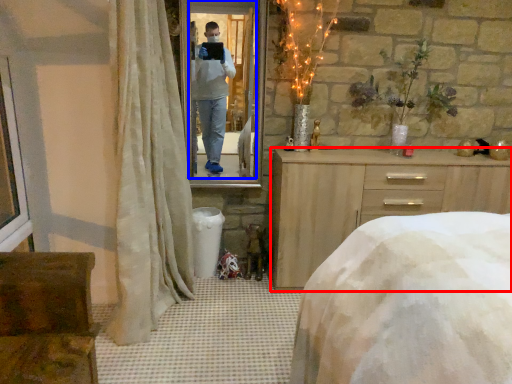
Question: Which point is closer to the camera, chest of drawers (highlighted by a red box) or mirror (highlighted by a blue box)?

Choices:
 (A) chest of drawers
 (B) mirror

Answer: (A)